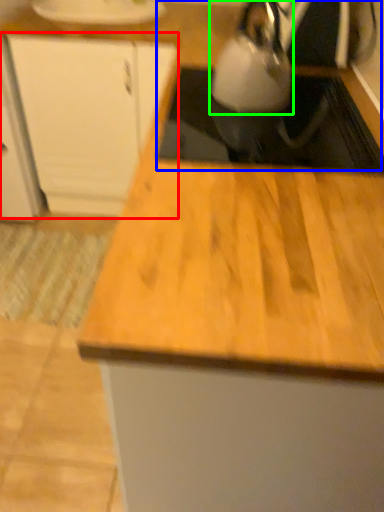
Question: Estimate the real-world distances between objects in this image. Which object is farther from cabinetry (highlighted by a red box), sink (highlighted by a blue box) or kettle (highlighted by a green box)?

Choices:
 (A) sink
 (B) kettle

Answer: (A)